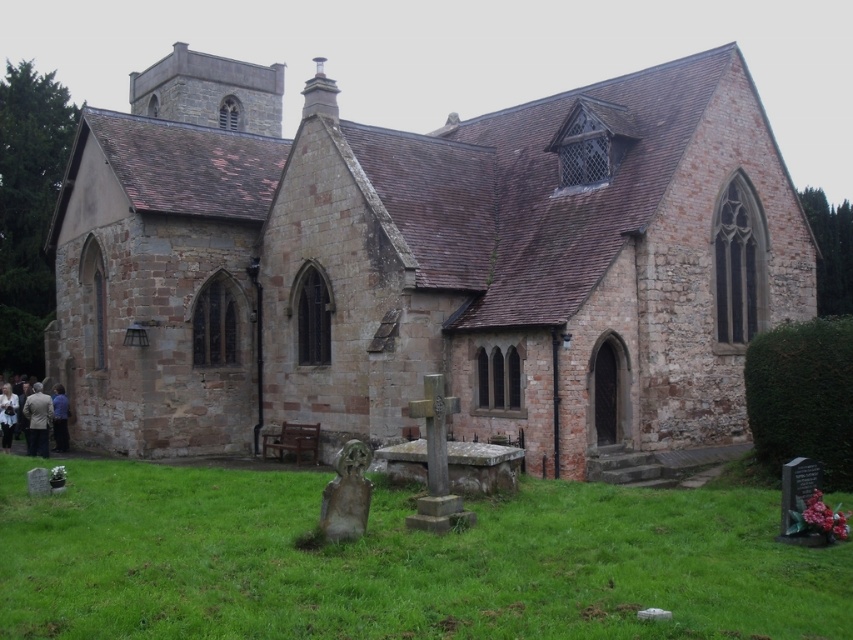
Question: Which object is positioned closest to the green grass at lower center?

Choices:
 (A) light brown suit at lower left
 (B) brown stone church at center

Answer: (B)

Question: Does brown stone church at center appear on the left side of light brown suit at lower left?

Choices:
 (A) no
 (B) yes

Answer: (A)

Question: Which of the following is the farthest from the observer?

Choices:
 (A) brown stone church at center
 (B) light brown suit at lower left

Answer: (B)

Question: Does brown stone church at center have a larger size compared to light brown suit at lower left?

Choices:
 (A) no
 (B) yes

Answer: (B)

Question: Does brown stone church at center appear on the right side of green grass at lower center?

Choices:
 (A) no
 (B) yes

Answer: (A)

Question: Among these points, which one is nearest to the camera?

Choices:
 (A) (287, 476)
 (B) (38, 432)
 (C) (329, 390)

Answer: (A)